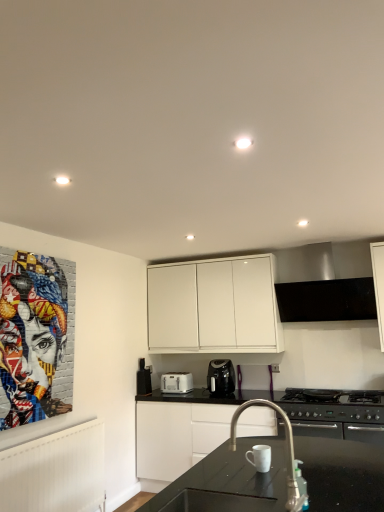
Question: Is satin nickel faucet at center not inside colorful mosaic portrait at left?

Choices:
 (A) yes
 (B) no

Answer: (A)

Question: Is colorful mosaic portrait at left completely or partially inside satin nickel faucet at center?

Choices:
 (A) no
 (B) yes

Answer: (A)

Question: Is satin nickel faucet at center positioned with its back to colorful mosaic portrait at left?

Choices:
 (A) yes
 (B) no

Answer: (B)

Question: From a real-world perspective, is satin nickel faucet at center positioned under colorful mosaic portrait at left based on gravity?

Choices:
 (A) no
 (B) yes

Answer: (B)

Question: From a real-world perspective, is satin nickel faucet at center on colorful mosaic portrait at left?

Choices:
 (A) no
 (B) yes

Answer: (A)

Question: Is satin silver exhaust hood at upper center situated inside black matte gas stove at lower right or outside?

Choices:
 (A) outside
 (B) inside

Answer: (A)

Question: Considering the positions of satin silver exhaust hood at upper center and black matte gas stove at lower right in the image, is satin silver exhaust hood at upper center wider or thinner than black matte gas stove at lower right?

Choices:
 (A) wide
 (B) thin

Answer: (B)

Question: From a real-world perspective, is satin silver exhaust hood at upper center above or below black matte gas stove at lower right?

Choices:
 (A) below
 (B) above

Answer: (B)

Question: In terms of height, does satin silver exhaust hood at upper center look taller or shorter compared to black matte gas stove at lower right?

Choices:
 (A) short
 (B) tall

Answer: (B)

Question: Is white matte cabinet at upper center, the 1th cabinetry when ordered from top to bottom, wider or thinner than white plastic toaster at center, the second kitchen appliance positioned from the right?

Choices:
 (A) thin
 (B) wide

Answer: (B)

Question: Considering the relative positions of white matte cabinet at upper center, which ranks as the 2th cabinetry in bottom-to-top order, and white plastic toaster at center, the second kitchen appliance positioned from the right, in the image provided, is white matte cabinet at upper center, which ranks as the 2th cabinetry in bottom-to-top order, to the left or to the right of white plastic toaster at center, the second kitchen appliance positioned from the right,?

Choices:
 (A) left
 (B) right

Answer: (B)

Question: From the image's perspective, relative to white plastic toaster at center, the second kitchen appliance positioned from the right, is white matte cabinet at upper center, which ranks as the 2th cabinetry in bottom-to-top order, above or below?

Choices:
 (A) above
 (B) below

Answer: (A)

Question: In the image, is white matte cabinet at upper center, the 1th cabinetry when ordered from top to bottom, positioned in front of or behind white plastic toaster at center, the second kitchen appliance positioned from the right?

Choices:
 (A) front
 (B) behind

Answer: (A)

Question: In the image, is black plastic coffee maker at center, the 2th kitchen appliance from the left, positioned in front of or behind white matte cabinet at upper center, the 1th cabinetry when ordered from top to bottom?

Choices:
 (A) front
 (B) behind

Answer: (A)

Question: Based on their sizes in the image, would you say black plastic coffee maker at center, which ranks as the 1th kitchen appliance in right-to-left order, is bigger or smaller than white matte cabinet at upper center, which ranks as the 2th cabinetry in bottom-to-top order?

Choices:
 (A) big
 (B) small

Answer: (B)